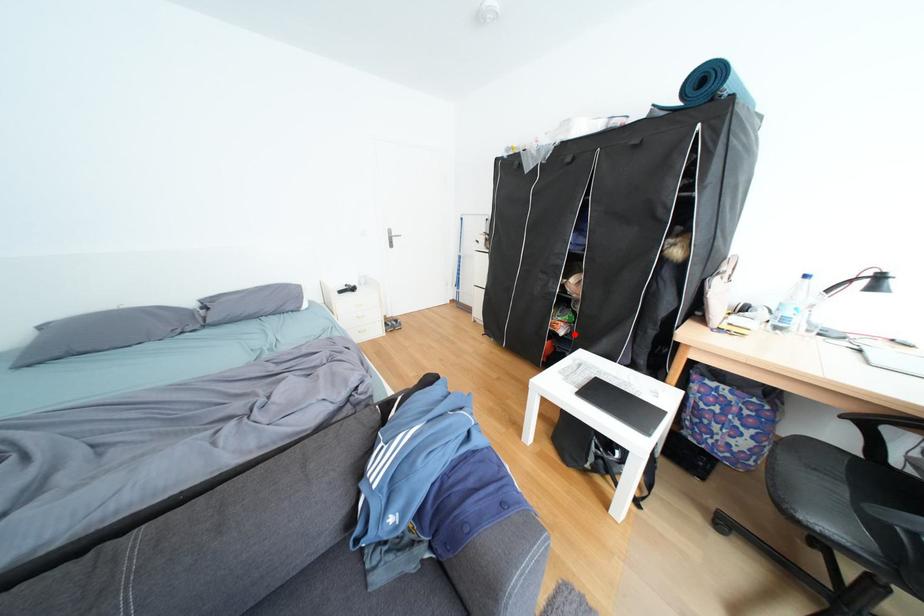
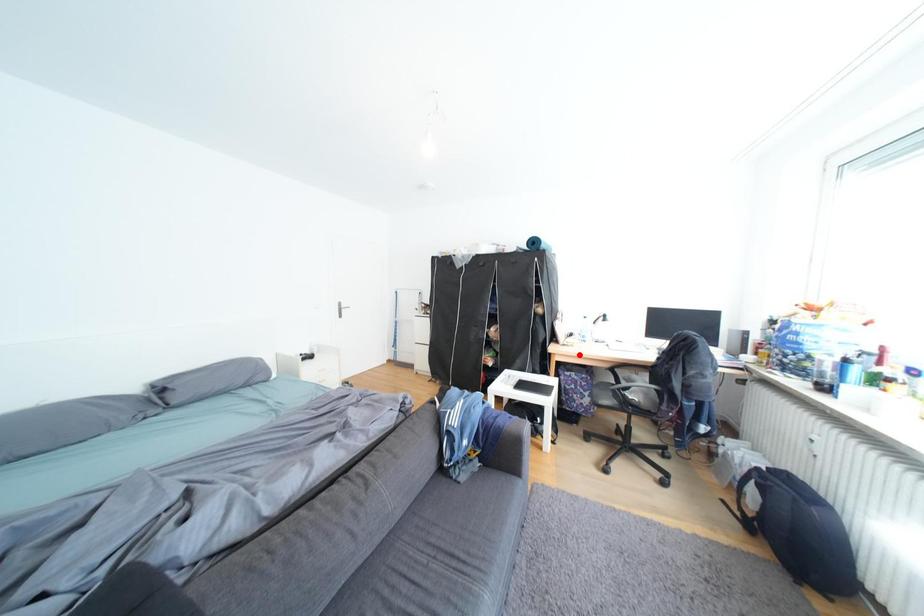
I am providing you with two images of the same scene from different viewpoints. A red point is marked on the first image and another point is marked on the second image. Are the points marked in image1 and image2 representing the same 3D position?

No